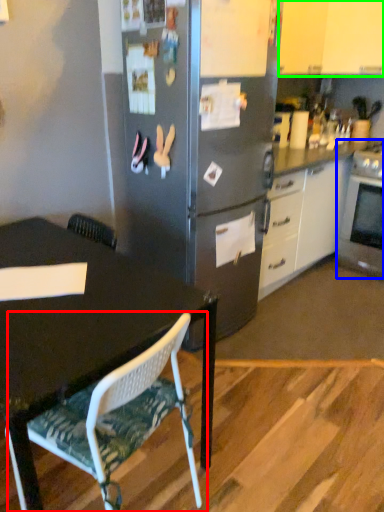
Question: Estimate the real-world distances between objects in this image. Which object is closer to chair (highlighted by a red box), oven (highlighted by a blue box) or cabinetry (highlighted by a green box)?

Choices:
 (A) oven
 (B) cabinetry

Answer: (A)